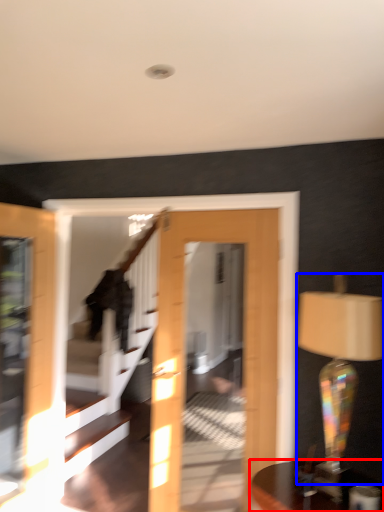
Question: Which of the following is the farthest to the observer, table (highlighted by a red box) or table lamp (highlighted by a blue box)?

Choices:
 (A) table
 (B) table lamp

Answer: (B)